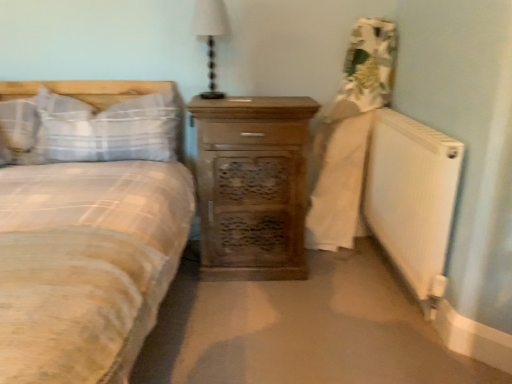
Question: From the image's perspective, is white matte radiator at lower right located above white plaid pillow at left, which appears as the first pillow when viewed from the left?

Choices:
 (A) no
 (B) yes

Answer: (A)

Question: Can you confirm if white matte radiator at lower right is wider than white plaid pillow at left, which appears as the first pillow when viewed from the left?

Choices:
 (A) no
 (B) yes

Answer: (A)

Question: Is white plaid pillow at left, arranged as the second pillow when viewed from the right, located within white matte radiator at lower right?

Choices:
 (A) no
 (B) yes

Answer: (A)

Question: Can you see white matte radiator at lower right touching white plaid pillow at left, arranged as the second pillow when viewed from the right?

Choices:
 (A) no
 (B) yes

Answer: (A)

Question: Can you confirm if white matte radiator at lower right is thinner than white plaid pillow at left, which appears as the first pillow when viewed from the left?

Choices:
 (A) yes
 (B) no

Answer: (A)

Question: Is wooden chest of drawers at center situated inside white plaid pillow at left, arranged as the second pillow when viewed from the right, or outside?

Choices:
 (A) outside
 (B) inside

Answer: (A)

Question: From the image's perspective, is wooden chest of drawers at center above or below white plaid pillow at left, which appears as the first pillow when viewed from the left?

Choices:
 (A) above
 (B) below

Answer: (B)

Question: From a real-world perspective, is wooden chest of drawers at center physically located above or below white plaid pillow at left, arranged as the second pillow when viewed from the right?

Choices:
 (A) above
 (B) below

Answer: (B)

Question: From their relative heights in the image, would you say wooden chest of drawers at center is taller or shorter than white plaid pillow at left, which appears as the first pillow when viewed from the left?

Choices:
 (A) short
 (B) tall

Answer: (B)

Question: In terms of width, does white fabric lampshade at upper center look wider or thinner when compared to white matte radiator at lower right?

Choices:
 (A) thin
 (B) wide

Answer: (B)

Question: Does point (194, 29) appear closer or farther from the camera than point (371, 210)?

Choices:
 (A) closer
 (B) farther

Answer: (A)

Question: Visually, is white fabric lampshade at upper center positioned to the left or to the right of white matte radiator at lower right?

Choices:
 (A) left
 (B) right

Answer: (A)

Question: Is white fabric lampshade at upper center situated inside white matte radiator at lower right or outside?

Choices:
 (A) outside
 (B) inside

Answer: (A)

Question: Does point (25, 115) appear closer or farther from the camera than point (387, 240)?

Choices:
 (A) closer
 (B) farther

Answer: (A)

Question: Considering the positions of white plaid pillow at left, arranged as the second pillow when viewed from the right, and white matte radiator at lower right in the image, is white plaid pillow at left, arranged as the second pillow when viewed from the right, taller or shorter than white matte radiator at lower right?

Choices:
 (A) tall
 (B) short

Answer: (B)